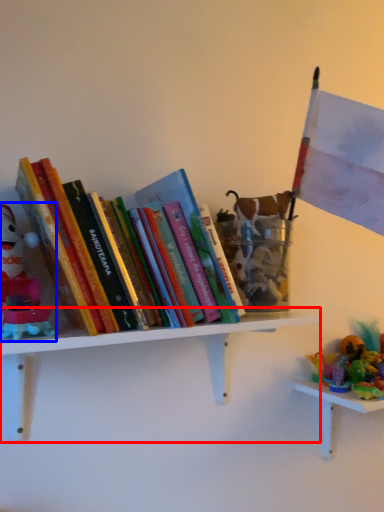
Question: Which object is further to the camera taking this photo, shelf (highlighted by a red box) or toy (highlighted by a blue box)?

Choices:
 (A) shelf
 (B) toy

Answer: (A)